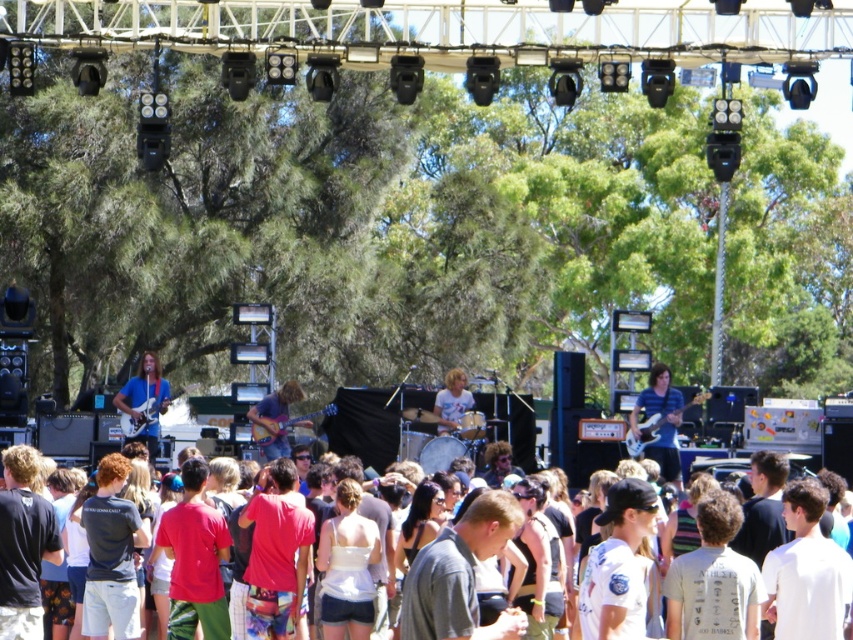
Does white cotton shirt at center lie in front of striped shirt at center?

Yes, it is in front of striped shirt at center.

Between point (206, 634) and point (654, 387), which one is positioned in front?

Point (206, 634)

Locate an element on the screen. white cotton shirt at center is located at coordinates (22, 568).

Is point (276, 403) in front of point (460, 369)?

Yes, it is in front of point (460, 369).

Which is above, shiny brown guitar at center or light blue denim shirt at center?

light blue denim shirt at center

The height and width of the screenshot is (640, 853). I want to click on shiny brown guitar at center, so click(x=274, y=417).

Between white cotton shirt at center and shiny blue guitar at center, which one has less height?

shiny blue guitar at center is shorter.

Is point (32, 515) more distant than point (113, 397)?

No, it is not.

Who is more distant from viewer, (3, 538) or (143, 410)?

Point (143, 410)

This screenshot has height=640, width=853. I want to click on white cotton shirt at center, so click(x=22, y=568).